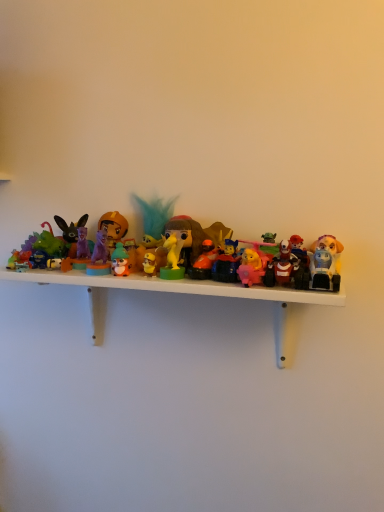
Question: Considering the positions of matte plastic toy at center, the 9th toy in the left-to-right sequence, and matte green plush at center, the ninth toy positioned from the right, in the image, is matte plastic toy at center, the 9th toy in the left-to-right sequence, wider or thinner than matte green plush at center, the ninth toy positioned from the right,?

Choices:
 (A) wide
 (B) thin

Answer: (A)

Question: Based on their positions, is matte plastic toy at center, the 9th toy in the left-to-right sequence, located to the left or right of matte green plush at center, the ninth toy positioned from the right?

Choices:
 (A) right
 (B) left

Answer: (A)

Question: Estimate the real-world distances between objects in this image. Which object is farther from the matte blue toy at left, positioned as the 1th toy in left-to-right order?

Choices:
 (A) pink plastic bear at center, arranged as the 11th toy when viewed from the left
 (B) shiny plastic figure at center, placed as the tenth toy when sorted from left to right
 (C) translucent yellow toy at center, which is counted as the 7th toy, starting from the left
 (D) matte purple figurine at left, which is the 3th toy in left-to-right order
 (E) teal feather at center, arranged as the 6th toy when viewed from the left

Answer: (A)

Question: Which of these objects is positioned farthest from the matte black rabbit at left, the 12th toy positioned from the right?

Choices:
 (A) matte purple figurine at left, marked as the 11th toy in a right-to-left arrangement
 (B) orange matte figure at center, positioned as the sixth toy in right-to-left order
 (C) translucent yellow toy at center, which is counted as the 7th toy, starting from the right
 (D) matte plastic toy at center, which is the fifth toy from right to left
 (E) pink plastic bear at center, which is counted as the 3th toy, starting from the right

Answer: (E)